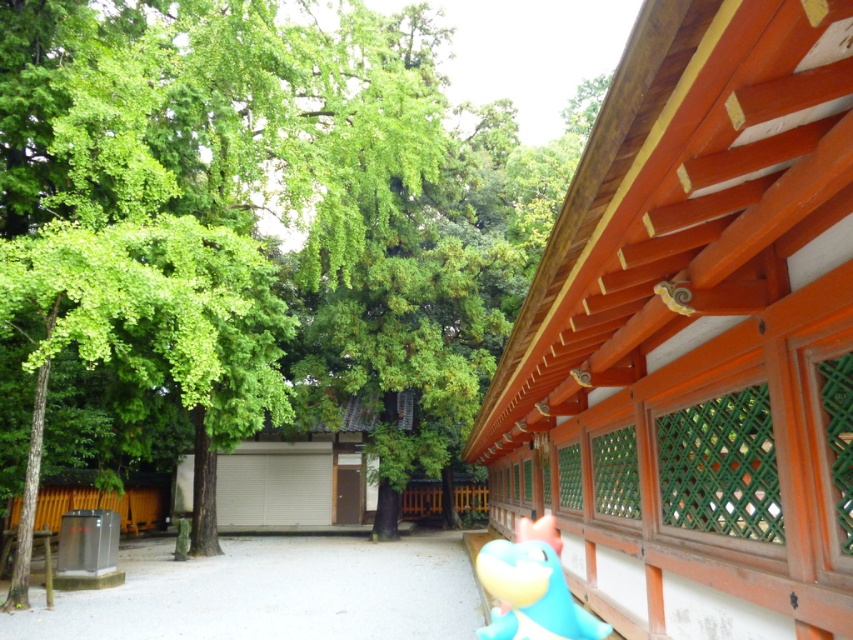
Can you confirm if green leafy tree at upper left is positioned above teal rubber toy at lower right?

Yes.

Is point (393, 120) positioned after point (508, 564)?

Yes, point (393, 120) is behind point (508, 564).

Is point (260, 250) positioned before point (543, 547)?

No, (260, 250) is further to viewer.

I want to click on green leafy tree at upper left, so [x=245, y=234].